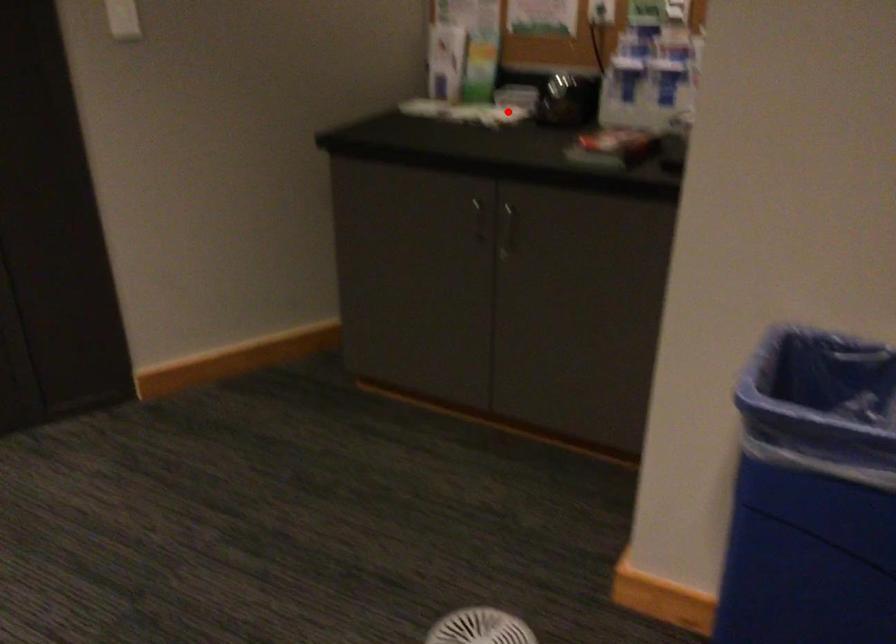
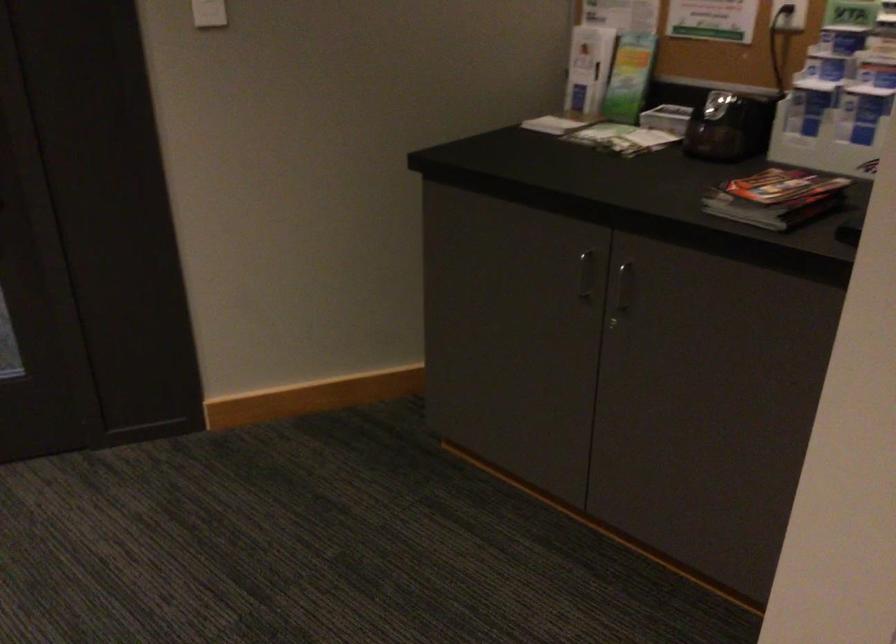
In the second image, find the point that corresponds to the highlighted location in the first image.

(647, 140)